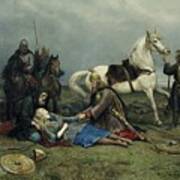
Identify the location of painting. The image size is (180, 180). (110, 153).